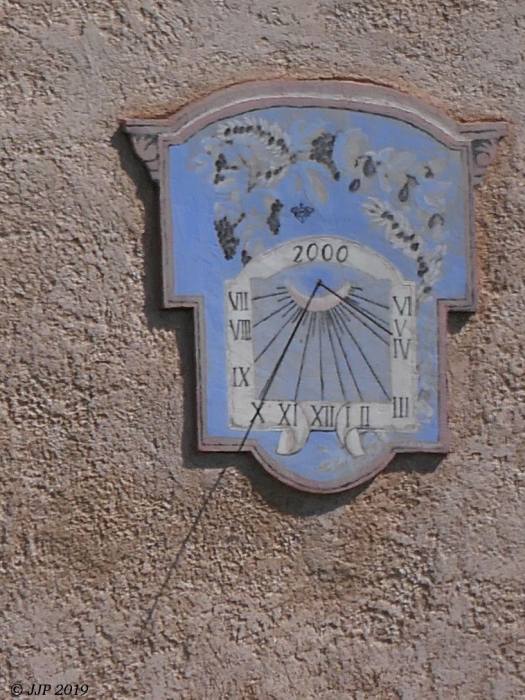
Locate an element on the screen. The height and width of the screenshot is (700, 525). wall is located at coordinates (100, 416), (456, 614).